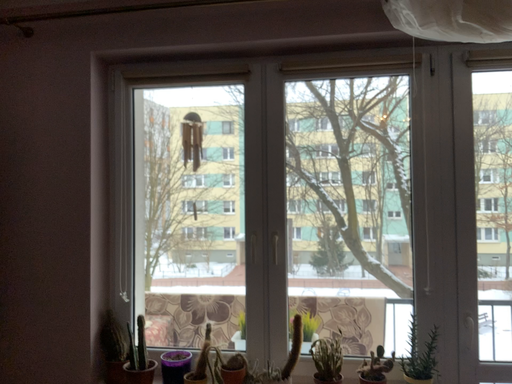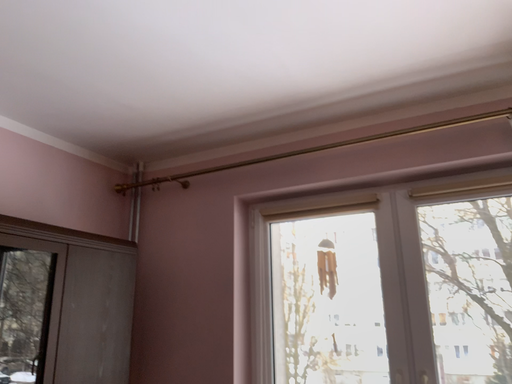
Question: Which way did the camera rotate in the video?

Choices:
 (A) rotated upward
 (B) rotated downward

Answer: (A)